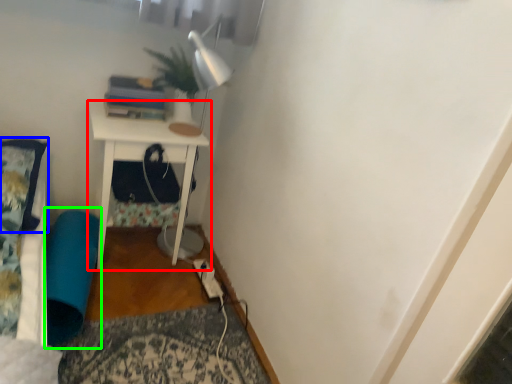
Question: Estimate the real-world distances between objects in this image. Which object is farther from nightstand (highlighted by a red box), pillow (highlighted by a blue box) or bean bag chair (highlighted by a green box)?

Choices:
 (A) pillow
 (B) bean bag chair

Answer: (A)